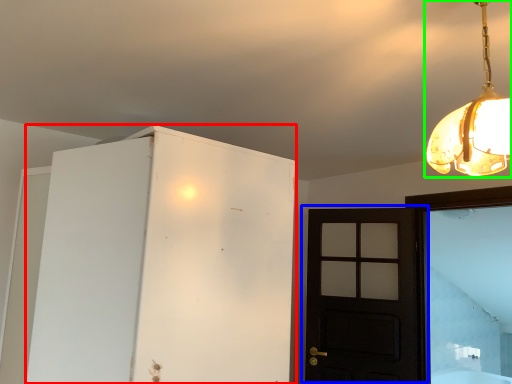
Question: Considering the real-world distances, which object is farthest from cabinetry (highlighted by a red box)? door (highlighted by a blue box) or lamp (highlighted by a green box)?

Choices:
 (A) door
 (B) lamp

Answer: (A)